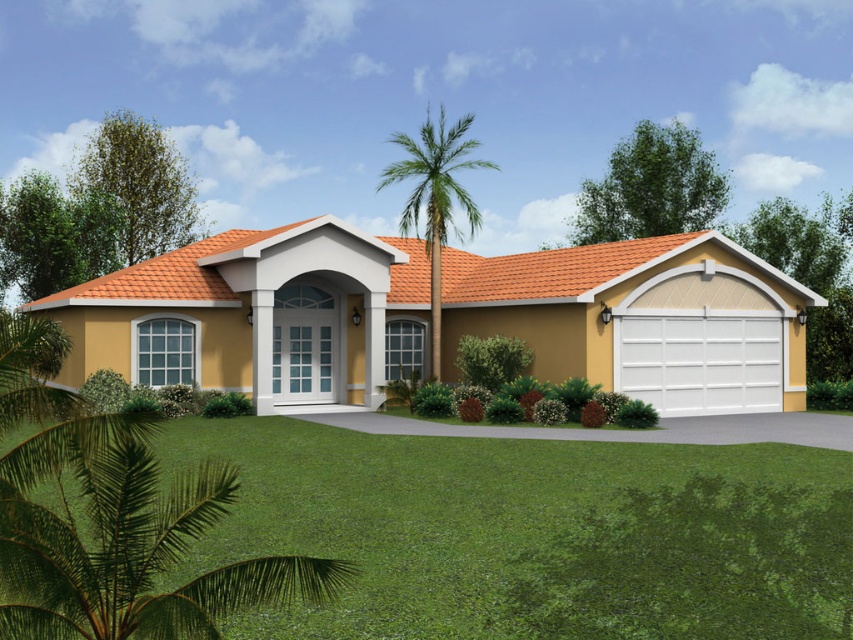
Does white textured garage door at center appear under green leafy palm tree at center?

Yes, white textured garage door at center is below green leafy palm tree at center.

Does white textured garage door at center have a larger size compared to green leafy palm tree at center?

Actually, white textured garage door at center might be smaller than green leafy palm tree at center.

Who is more distant from viewer, (236, 296) or (479, 225)?

Point (479, 225)

In order to click on white textured garage door at center in this screenshot , I will do click(258, 314).

Can you confirm if green grass at lower center is bigger than white textured garage door at center?

Actually, green grass at lower center might be smaller than white textured garage door at center.

Does point (352, 500) lie in front of point (149, 273)?

Yes, it is.

I want to click on green grass at lower center, so click(x=531, y=532).

Does green grass at lower center have a lesser width compared to green leafy palm tree at center?

Yes, green grass at lower center is thinner than green leafy palm tree at center.

Can you confirm if green grass at lower center is bigger than green leafy palm tree at center?

No.

Where is `green grass at lower center`? This screenshot has height=640, width=853. green grass at lower center is located at coordinates (531, 532).